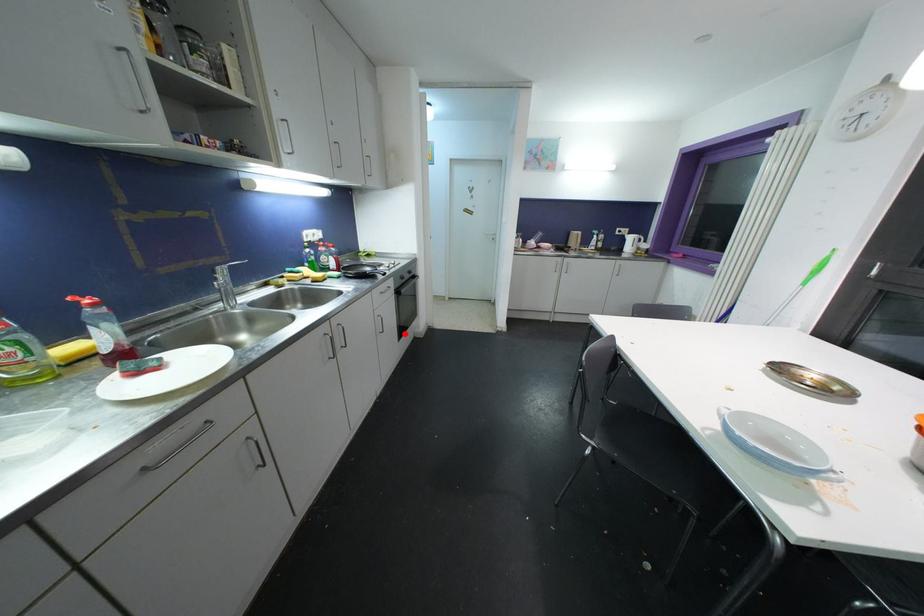
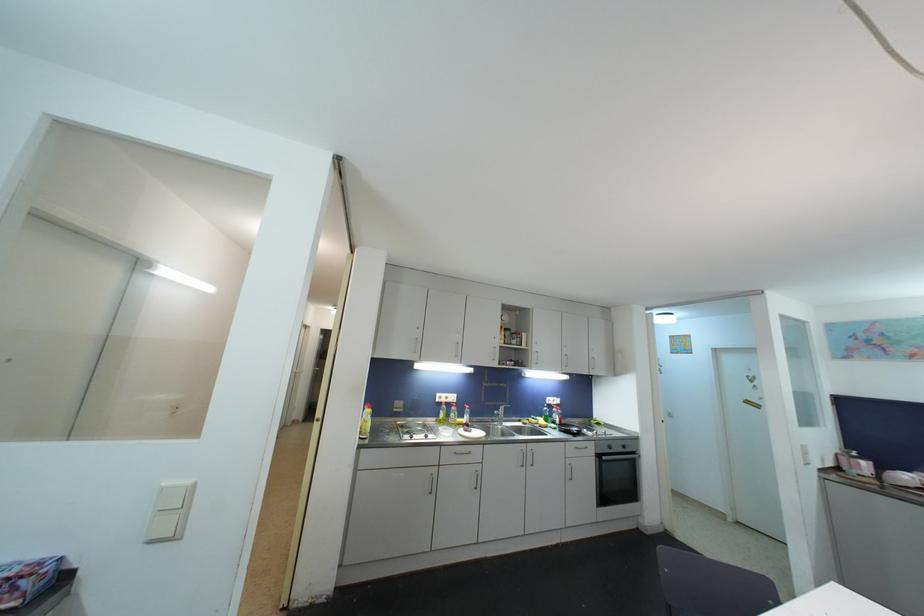
Question: I am providing you with two images of the same scene from different viewpoints. In image1, a red point is highlighted. Considering the same 3D point in image2, which of the following is correct?

Choices:
 (A) It is closer
 (B) It is farther

Answer: (B)